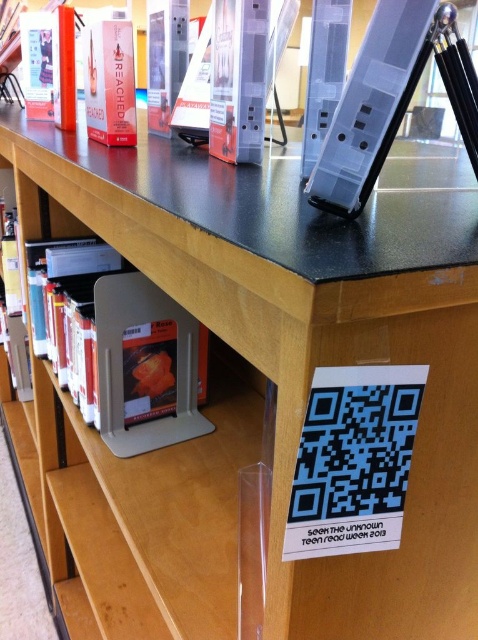
Between orange matte book at center and blue matte qr code at lower right, which one is positioned higher?

orange matte book at center is higher up.

Is orange matte book at center closer to camera compared to blue matte qr code at lower right?

No, it is behind blue matte qr code at lower right.

Between point (55, 365) and point (387, 394), which one is positioned behind?

The point (55, 365) is behind.

Image resolution: width=478 pixels, height=640 pixels. I want to click on orange matte book at center, so click(102, 330).

Who is shorter, orange matte book at center or matte plastic tablet at upper right?

matte plastic tablet at upper right is shorter.

Does orange matte book at center appear on the right side of matte plastic tablet at upper right?

Incorrect, orange matte book at center is not on the right side of matte plastic tablet at upper right.

This screenshot has width=478, height=640. In order to click on orange matte book at center in this screenshot , I will do `click(102, 330)`.

Does point (402, 499) come farther from viewer compared to point (362, 180)?

That is False.

Can you confirm if blue matte qr code at lower right is positioned to the left of matte plastic tablet at upper right?

Correct, you'll find blue matte qr code at lower right to the left of matte plastic tablet at upper right.

Is point (343, 422) closer to viewer compared to point (373, 132)?

Yes, it is.

Identify the location of blue matte qr code at lower right. The width and height of the screenshot is (478, 640). (354, 460).